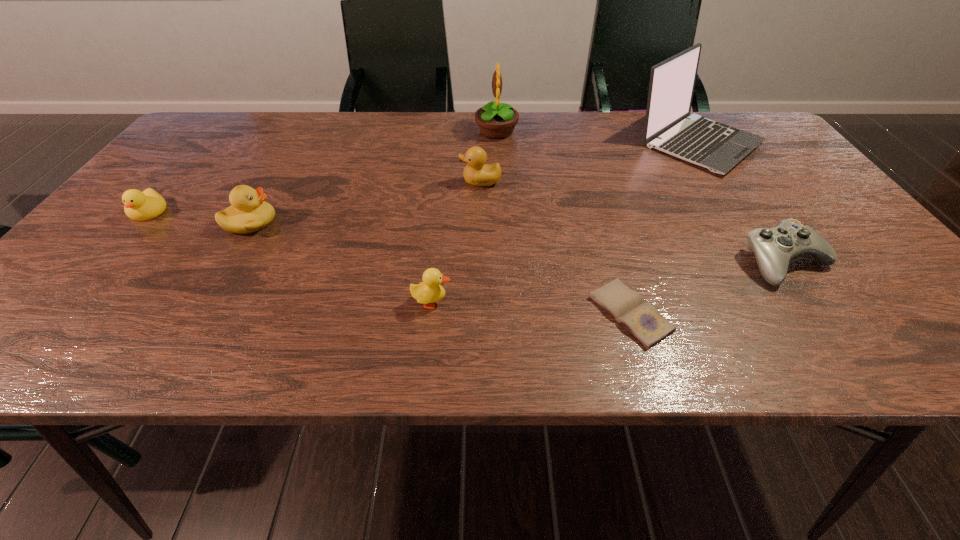
Where is `vacant position in the image that satisfies the following two spatial constraints: 1. facing forward on the control; 2. on the left side of the rightmost duckling`? This screenshot has height=540, width=960. vacant position in the image that satisfies the following two spatial constraints: 1. facing forward on the control; 2. on the left side of the rightmost duckling is located at coordinates (481, 262).

You are a GUI agent. You are given a task and a screenshot of the screen. Output one action in this format:
    pyautogui.click(x=<x>, y=<y>)
    Task: Click on the free space that satisfies the following two spatial constraints: 1. on the back side of the shortest object; 2. facing forward on the farthest duckling
    The width and height of the screenshot is (960, 540).
    Given the screenshot: What is the action you would take?
    pyautogui.click(x=590, y=181)

I want to click on blank area in the image that satisfies the following two spatial constraints: 1. on the face of the diary; 2. on the right side of the sunflower, so click(x=506, y=314).

Locate an element on the screen. Image resolution: width=960 pixels, height=540 pixels. free space that satisfies the following two spatial constraints: 1. at the front screen of the laptop_computer; 2. on the front-facing side of the nearest duckling is located at coordinates (806, 302).

You are a GUI agent. You are given a task and a screenshot of the screen. Output one action in this format:
    pyautogui.click(x=<x>, y=<y>)
    Task: Click on the free spot that satisfies the following two spatial constraints: 1. at the front screen of the laptop_computer; 2. facing forward on the farthest duckling
    
    Given the screenshot: What is the action you would take?
    pyautogui.click(x=725, y=181)

You are a GUI agent. You are given a task and a screenshot of the screen. Output one action in this format:
    pyautogui.click(x=<x>, y=<y>)
    Task: Click on the free location that satisfies the following two spatial constraints: 1. facing forward on the control; 2. on the right side of the farthest duckling
    
    Given the screenshot: What is the action you would take?
    pyautogui.click(x=481, y=262)

You are a GUI agent. You are given a task and a screenshot of the screen. Output one action in this format:
    pyautogui.click(x=<x>, y=<y>)
    Task: Click on the vacant space that satisfies the following two spatial constraints: 1. at the front screen of the laptop_computer; 2. facing forward on the farthest duckling
    The image size is (960, 540).
    Given the screenshot: What is the action you would take?
    tap(725, 181)

The width and height of the screenshot is (960, 540). I want to click on free region that satisfies the following two spatial constraints: 1. on the face of the sunflower; 2. on the right side of the third object from right to left, so click(x=506, y=314).

Find the location of a particular element. The width and height of the screenshot is (960, 540). vacant region that satisfies the following two spatial constraints: 1. on the back side of the control; 2. on the face of the sunflower is located at coordinates (695, 131).

I want to click on vacant region that satisfies the following two spatial constraints: 1. on the face of the sunflower; 2. on the left side of the diary, so click(x=506, y=314).